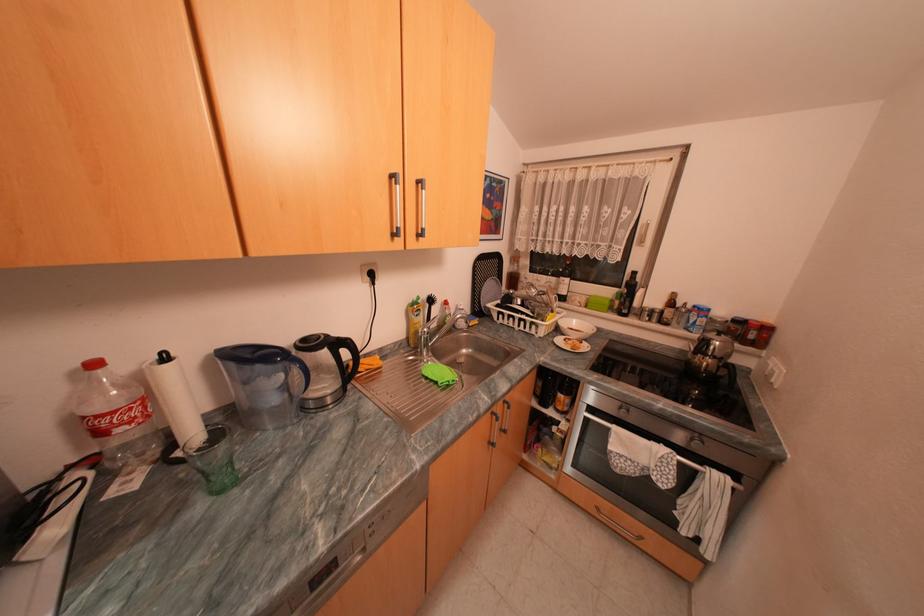
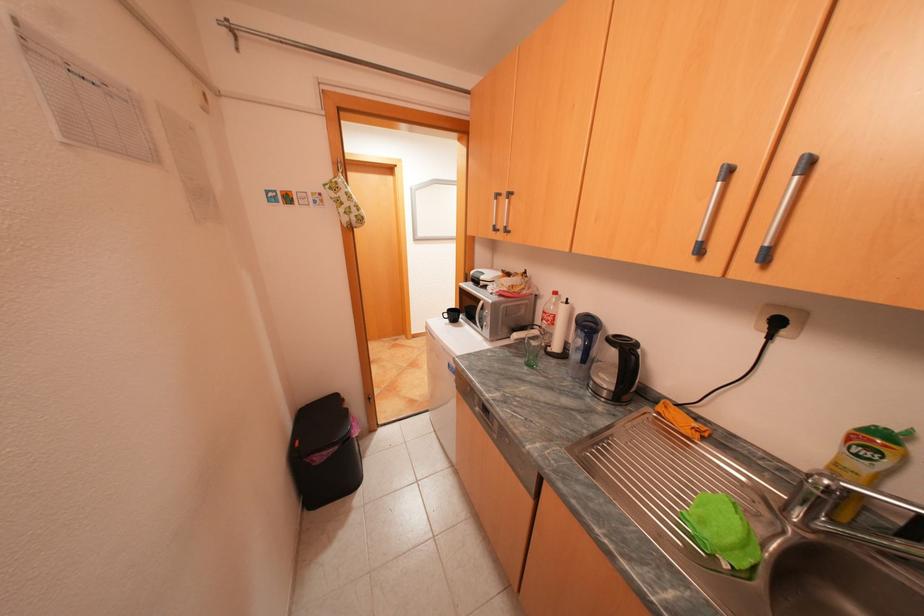
The images are taken continuously from a first-person perspective. In which direction is your viewpoint rotating?

The camera rotated toward left-down.